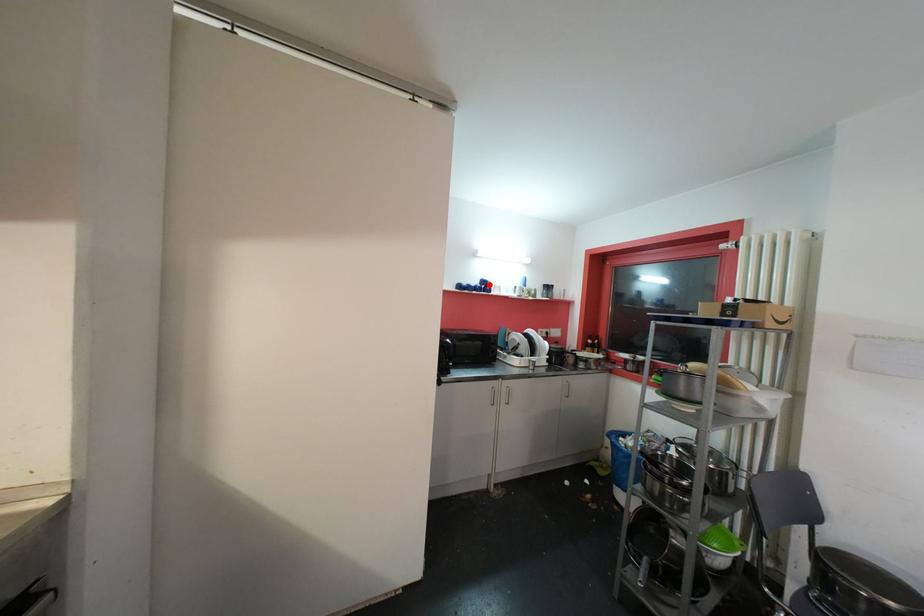
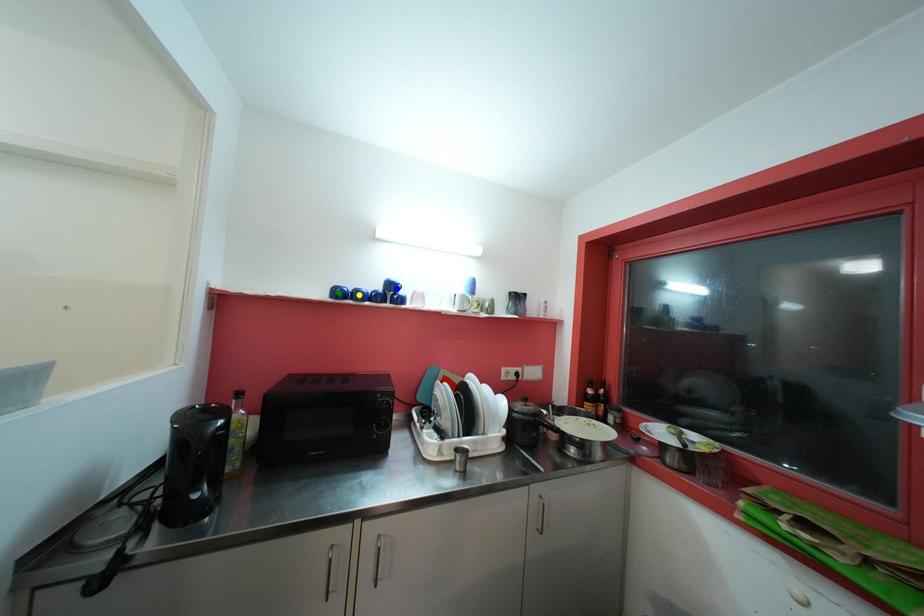
Question: I am providing you with two images of the same scene from different viewpoints. A red point is marked on the first image. You are given multiple points on the second image. Which mark in image 2 goes with the point in image 1?

Choices:
 (A) blue point
 (B) green point
 (C) yellow point

Answer: (A)